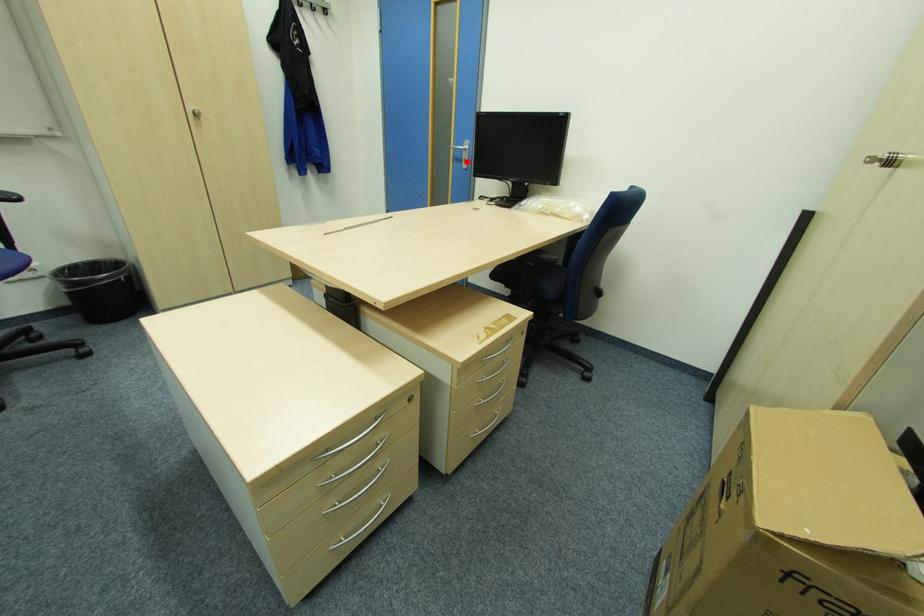
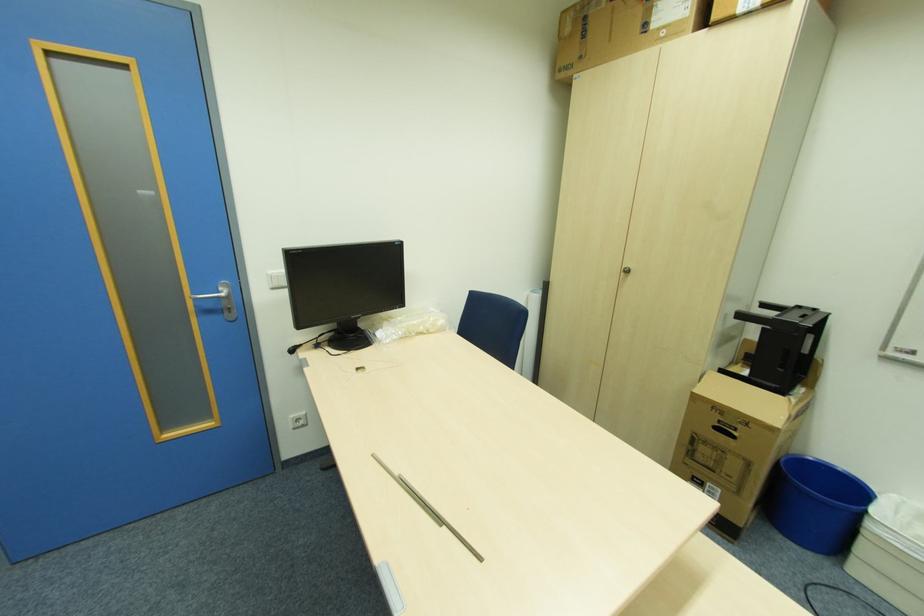
The point at the highlighted location is marked in the first image. Where is the corresponding point in the second image?

(234, 310)